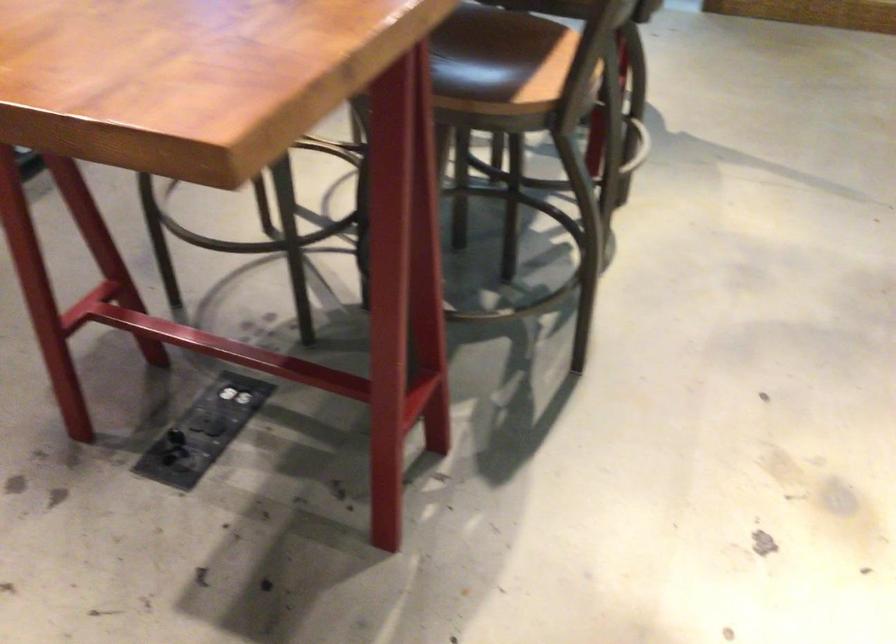
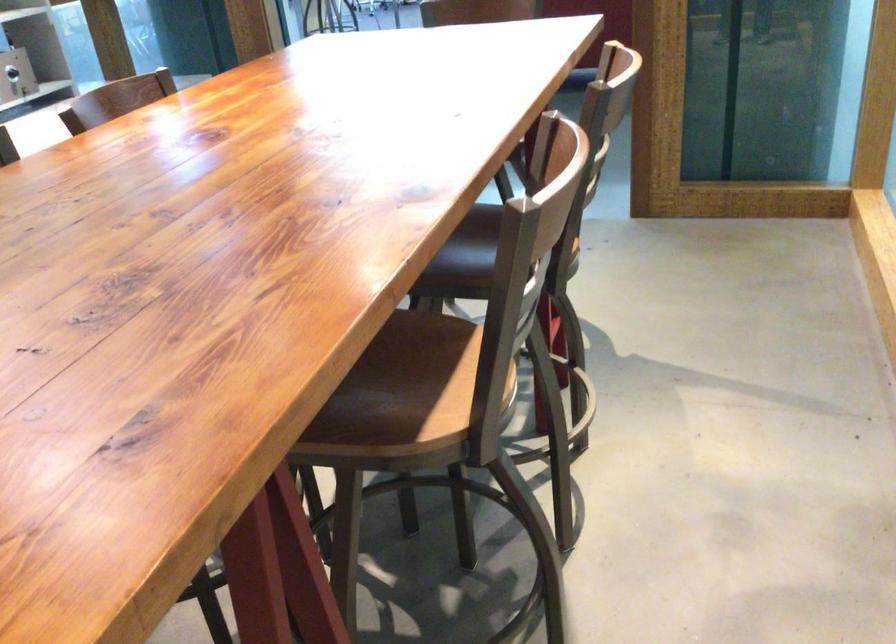
Question: Based on the continuous images, in which direction is the camera rotating? Reply with the corresponding letter.

Choices:
 (A) Left
 (B) Right
 (C) Up
 (D) Down

Answer: (C)